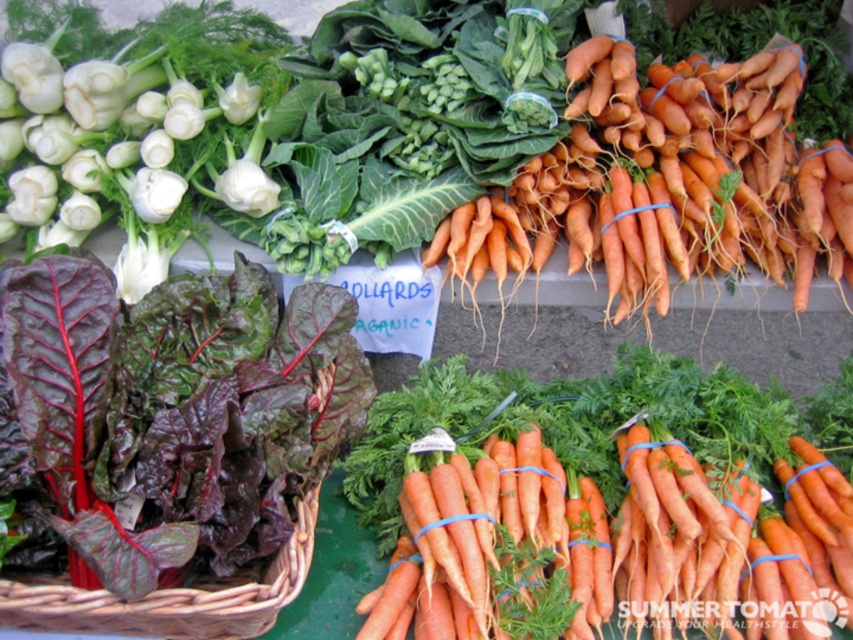
Does dark red leafy greens at left have a larger size compared to brown woven basket at lower left?

Indeed, dark red leafy greens at left has a larger size compared to brown woven basket at lower left.

Which is more to the left, dark red leafy greens at left or brown woven basket at lower left?

Positioned to the left is dark red leafy greens at left.

Locate an element on the screen. The height and width of the screenshot is (640, 853). dark red leafy greens at left is located at coordinates (170, 413).

Identify the location of dark red leafy greens at left. (170, 413).

Identify the location of dark red leafy greens at left. The image size is (853, 640). (170, 413).

In order to click on dark red leafy greens at left in this screenshot , I will do `click(170, 413)`.

Find the location of `dark red leafy greens at left`. dark red leafy greens at left is located at coordinates (170, 413).

Is orange smooth carrots at center bigger than brown woven basket at lower left?

Yes.

Which is more to the right, orange smooth carrots at center or brown woven basket at lower left?

orange smooth carrots at center is more to the right.

The width and height of the screenshot is (853, 640). What are the coordinates of `orange smooth carrots at center` in the screenshot? It's located at (589, 541).